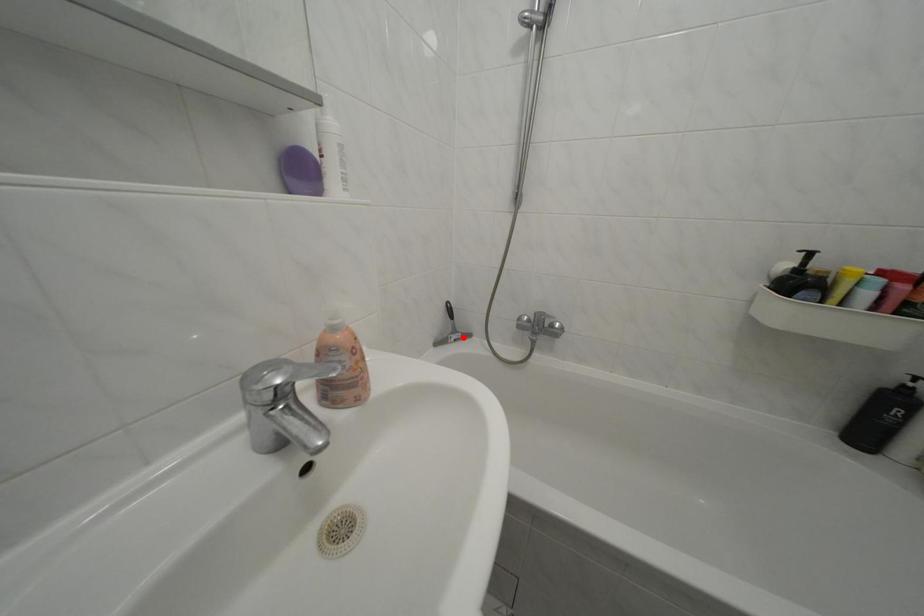
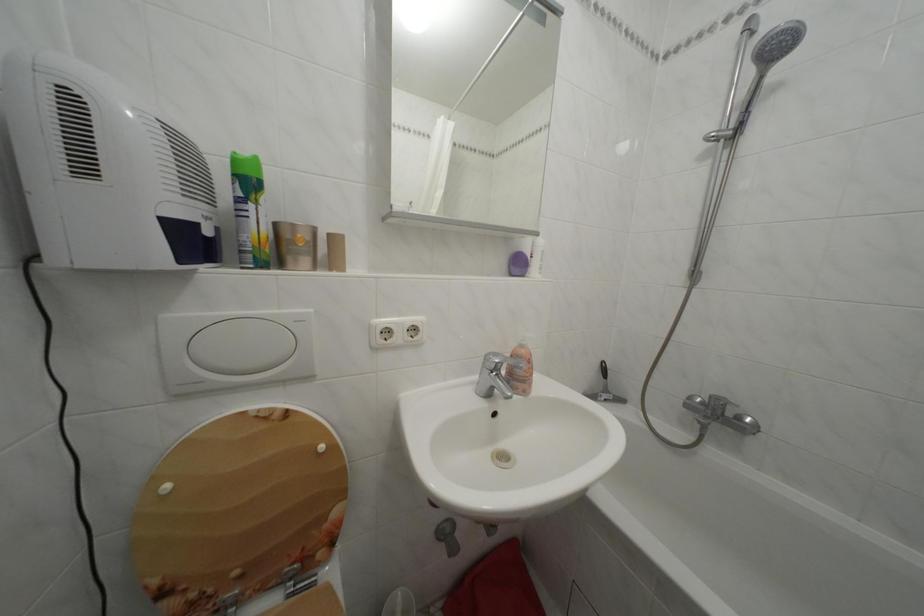
In the second image, find the point that corresponds to the highlighted location in the first image.

(614, 397)